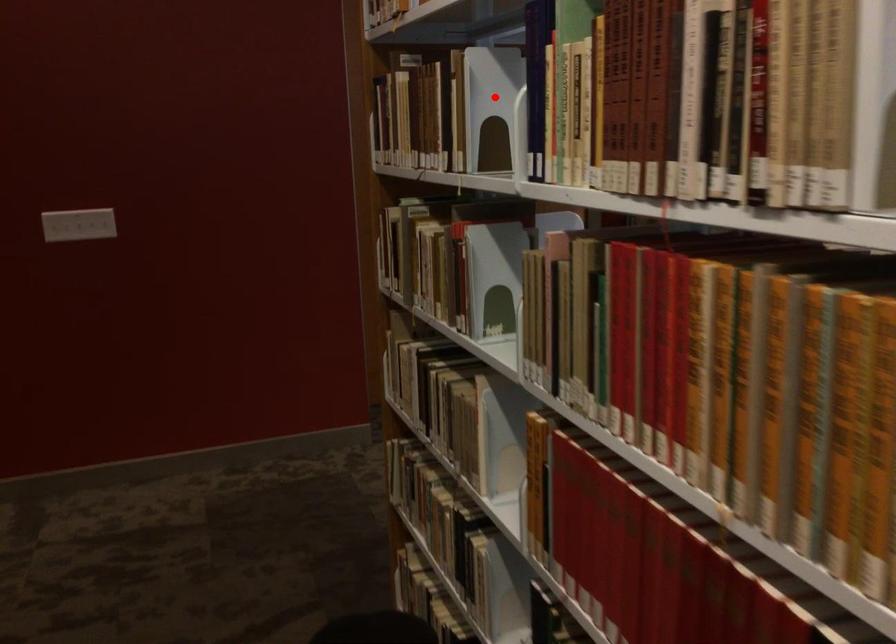
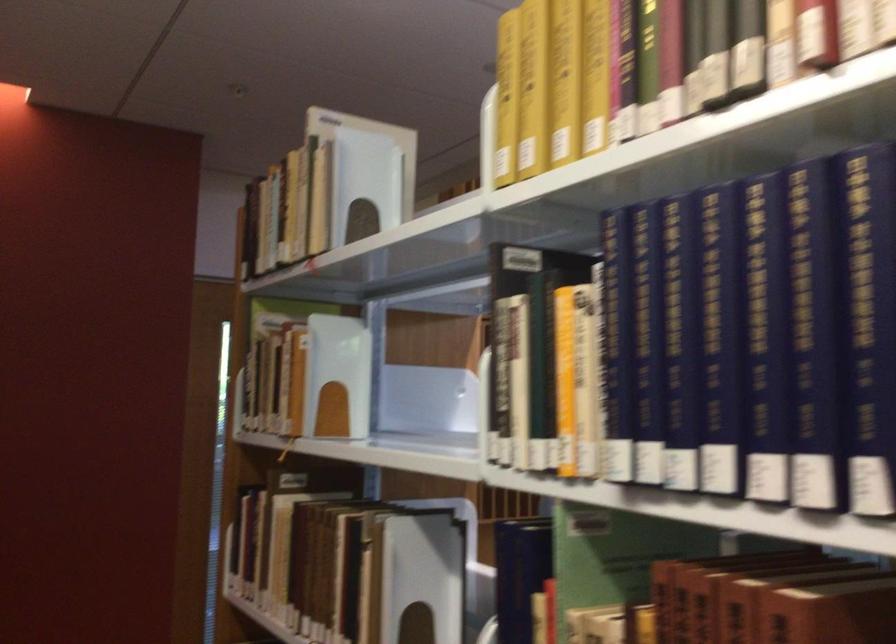
Question: I am providing you with two images of the same scene from different viewpoints. Given a red point in image1, look at the same physical point in image2. Is it:

Choices:
 (A) Closer to the viewpoint
 (B) Farther from the viewpoint

Answer: (A)